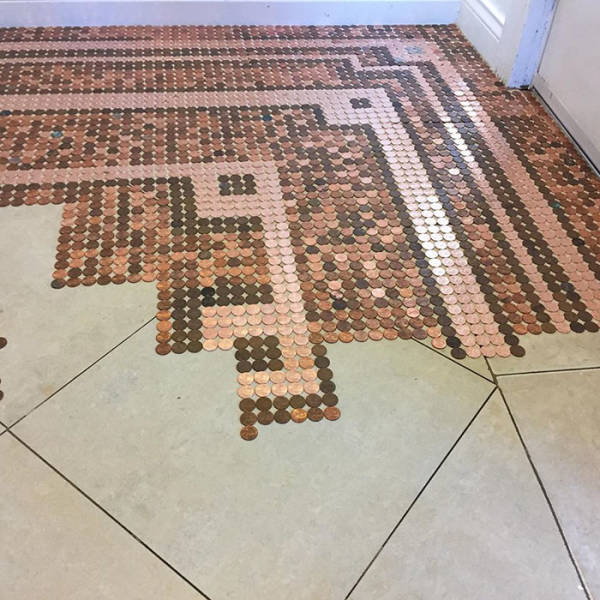
Locate an element on the screen. Image resolution: width=600 pixels, height=600 pixels. moulding is located at coordinates (514, 27).